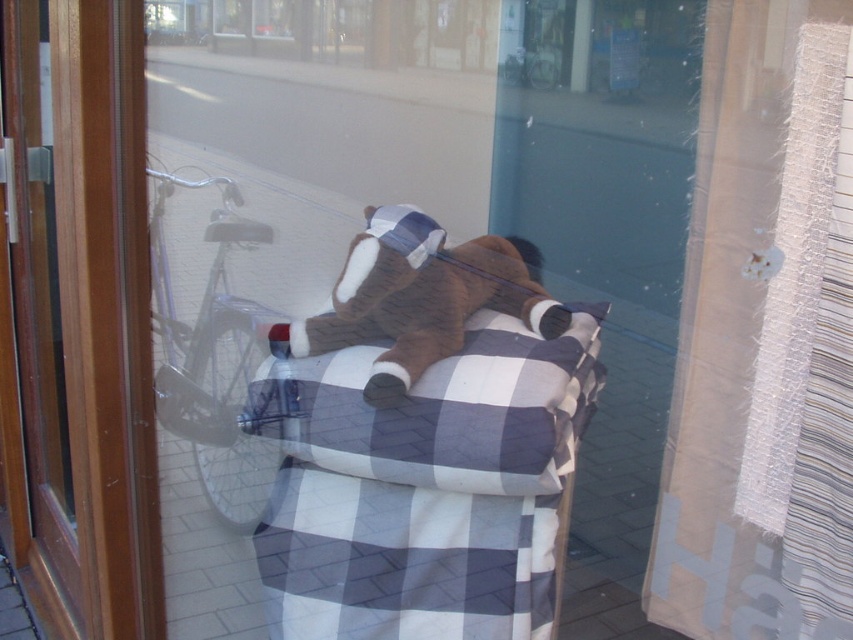
Question: Is blue plaid fabric at center closer to camera compared to brown plush toy at center?

Choices:
 (A) yes
 (B) no

Answer: (B)

Question: Based on their relative distances, which object is nearer to the plush bear at center?

Choices:
 (A) blue plaid fabric at center
 (B) brown wood screen door at center
 (C) checkered fabric blanket at center
 (D) brown plush toy at center

Answer: (C)

Question: Does plush bear at center appear on the right side of brown wood screen door at center?

Choices:
 (A) no
 (B) yes

Answer: (B)

Question: Does plush bear at center appear under blue plaid fabric at center?

Choices:
 (A) yes
 (B) no

Answer: (B)

Question: Which point is farther to the camera?

Choices:
 (A) brown plush toy at center
 (B) plush bear at center
 (C) brown wood screen door at center

Answer: (B)

Question: Considering the real-world distances, which object is farthest from the plush bear at center?

Choices:
 (A) checkered fabric blanket at center
 (B) blue plaid fabric at center
 (C) textured beige curtain at right

Answer: (C)